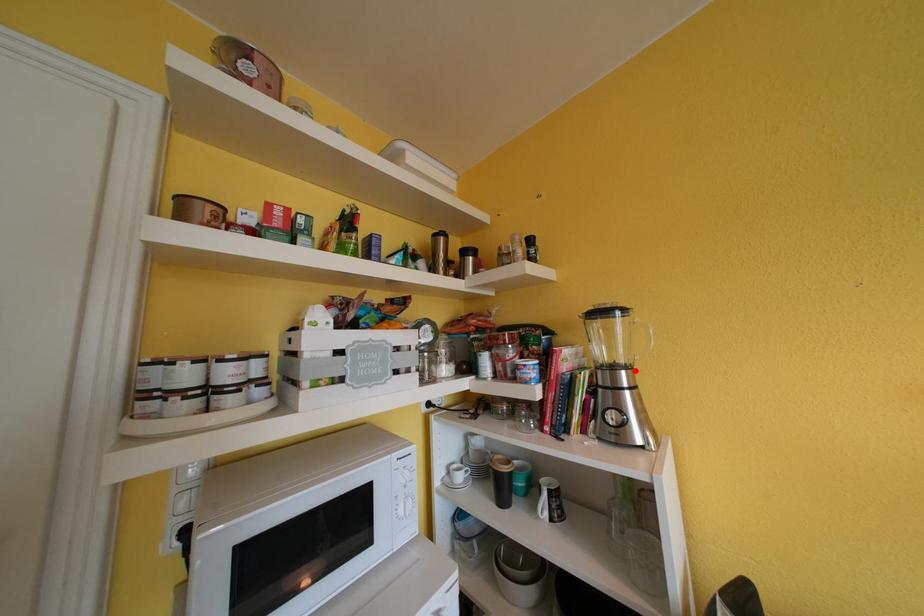
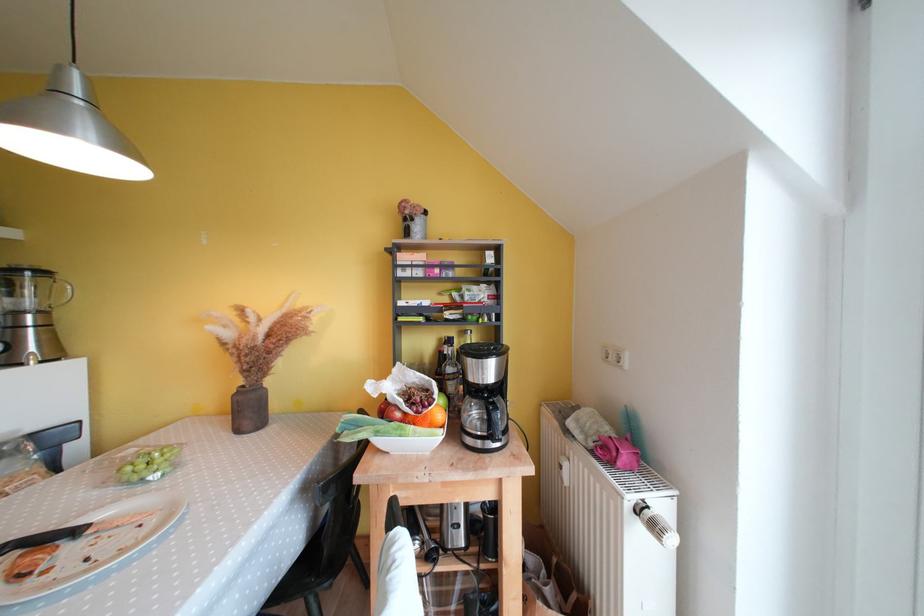
Find the pixel in the second image that matches the highlighted location in the first image.

(49, 315)